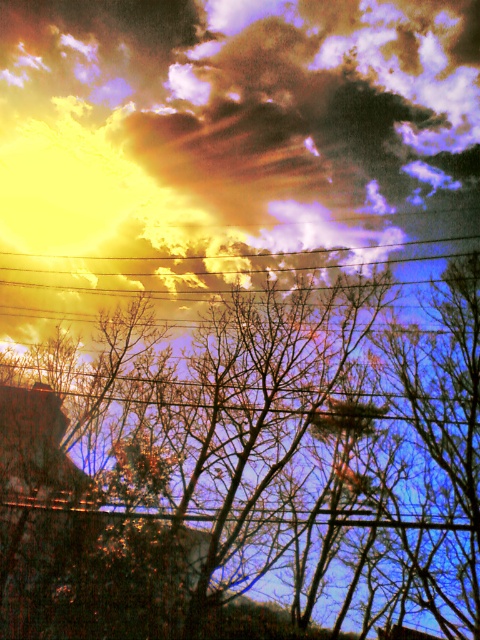
Question: Which of the following is the farthest from the observer?

Choices:
 (A) bare branches at center
 (B) metallic wire at upper center
 (C) golden textured cloud at upper center

Answer: (B)

Question: In this image, where is bare branches at center located relative to metallic wire at upper center?

Choices:
 (A) left
 (B) right

Answer: (A)

Question: Is bare branches at center thinner than golden textured cloud at upper center?

Choices:
 (A) yes
 (B) no

Answer: (B)

Question: Which of these objects is positioned closest to the metallic wire at upper center?

Choices:
 (A) golden textured cloud at upper center
 (B) bare branches at center

Answer: (A)

Question: Can you confirm if bare branches at center is thinner than golden textured cloud at upper center?

Choices:
 (A) no
 (B) yes

Answer: (A)

Question: Which point is farther from the camera taking this photo?

Choices:
 (A) (394, 138)
 (B) (72, 442)

Answer: (B)